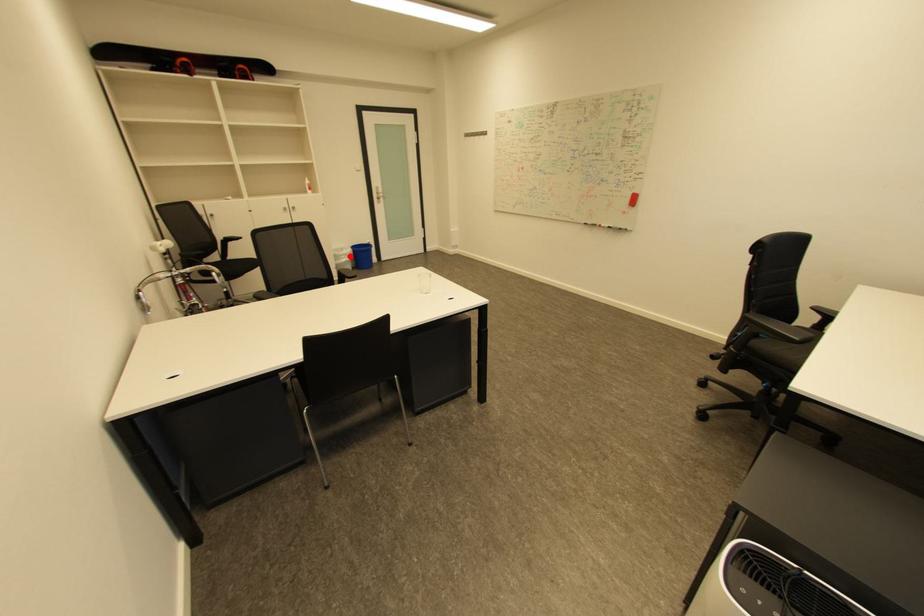
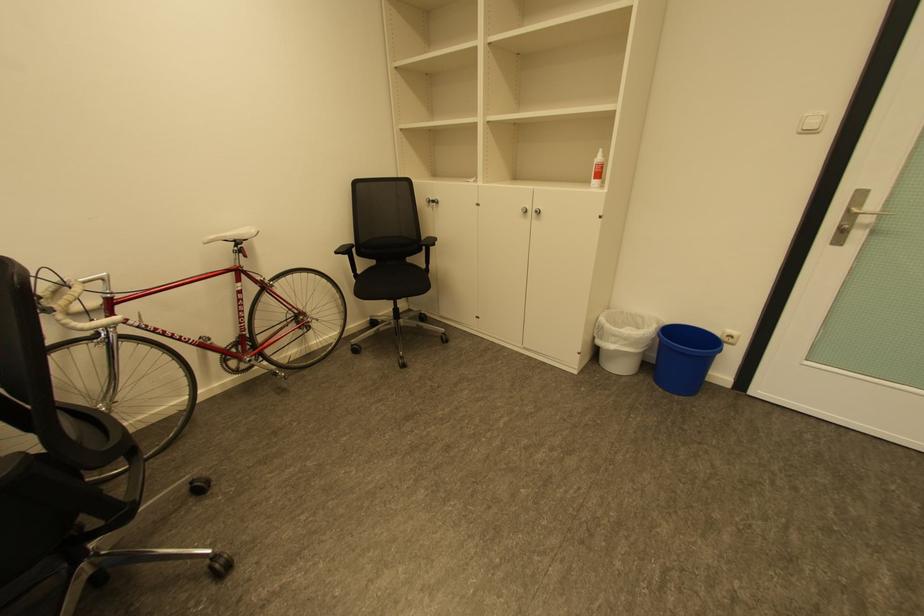
In the second image, find the point that corresponds to the highlighted location in the first image.

(622, 337)